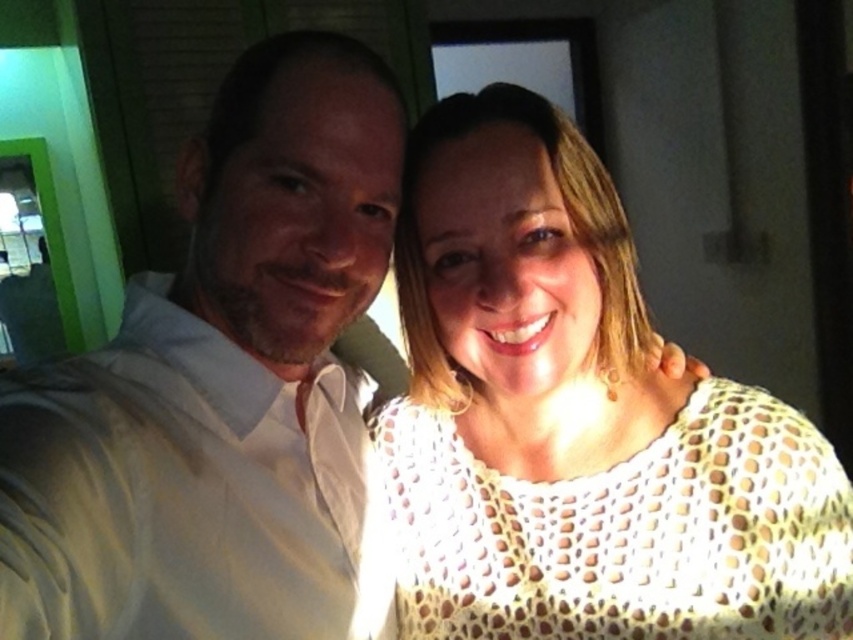
Question: Which object is closer to the camera taking this photo?

Choices:
 (A) white crochet top at center
 (B) white smooth shirt at left

Answer: (B)

Question: Does white crochet top at center appear on the right side of white smooth shirt at left?

Choices:
 (A) yes
 (B) no

Answer: (A)

Question: Is white crochet top at center bigger than white smooth shirt at left?

Choices:
 (A) yes
 (B) no

Answer: (B)

Question: Which object appears farthest from the camera in this image?

Choices:
 (A) white smooth shirt at left
 (B) white crochet top at center

Answer: (B)

Question: Which point is closer to the camera?

Choices:
 (A) 184,570
 (B) 556,320

Answer: (A)

Question: Can you confirm if white crochet top at center is positioned to the right of white smooth shirt at left?

Choices:
 (A) no
 (B) yes

Answer: (B)